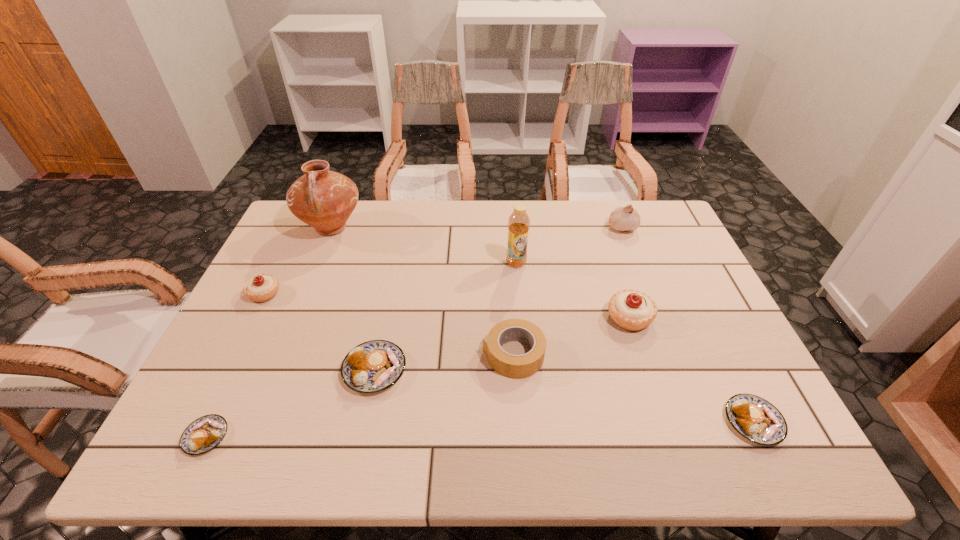
This screenshot has width=960, height=540. What are the coordinates of `vacant space situated at the edge of the duct tape` in the screenshot? It's located at (339, 355).

Locate an element on the screen. The width and height of the screenshot is (960, 540). free region located at the edge of the duct tape is located at coordinates (462, 355).

Locate an element on the screen. This screenshot has width=960, height=540. vacant space located on the back of the second brown pastry from right to left is located at coordinates (398, 254).

At what (x,y) coordinates should I click in order to perform the action: click on vacant space located on the left of the eighth tallest object. Please return your answer as a coordinate pair (x, y). The image size is (960, 540). Looking at the image, I should click on (x=586, y=422).

Identify the location of free region located on the right of the shortest pastry. The image size is (960, 540). (304, 436).

Locate an element on the screen. pottery present at the far edge is located at coordinates (323, 199).

Where is `garlic present at the far edge`? garlic present at the far edge is located at coordinates (622, 218).

Image resolution: width=960 pixels, height=540 pixels. Find the location of `pottery at the left edge`. pottery at the left edge is located at coordinates (323, 199).

Locate an element on the screen. The height and width of the screenshot is (540, 960). garlic that is positioned at the right edge is located at coordinates (622, 218).

Where is `pastry that is at the right edge`? The height and width of the screenshot is (540, 960). pastry that is at the right edge is located at coordinates (756, 419).